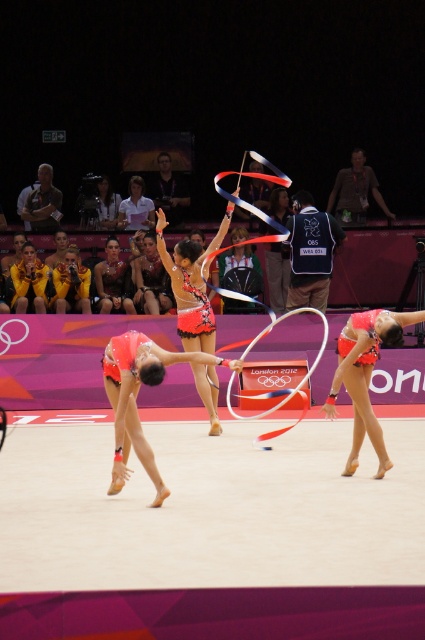
Question: Estimate the real-world distances between objects in this image. Which object is closer to the shiny red leotard at center?

Choices:
 (A) matte gold jacket at left
 (B) shiny silver gymnastics outfit at center
 (C) shiny metallic gymnastics outfit at center
 (D) shiny red ribbon at center

Answer: (C)

Question: Which point appears closest to the camera in this image?

Choices:
 (A) (144, 291)
 (B) (283, 216)
 (C) (105, 276)

Answer: (A)

Question: Can you confirm if shiny metallic gymnastics outfit at center is thinner than matte gold jacket at left?

Choices:
 (A) no
 (B) yes

Answer: (A)

Question: Is shiny red fabric at center above shiny silver gymnastics outfit at center?

Choices:
 (A) yes
 (B) no

Answer: (B)

Question: Is matte orange leotard at center positioned before matte gold jacket at left?

Choices:
 (A) yes
 (B) no

Answer: (A)

Question: Which point is closer to the camera taking this photo?

Choices:
 (A) coord(132,308)
 (B) coord(357,333)
 (C) coord(209,376)

Answer: (B)